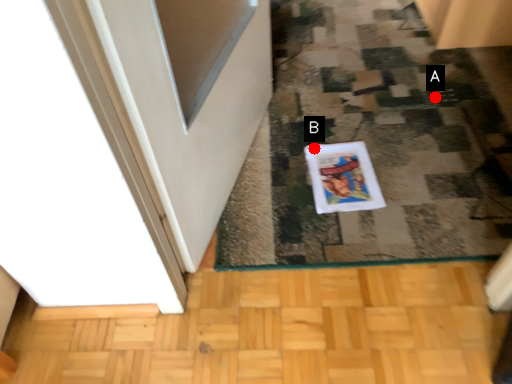
Question: Two points are circled on the image, labeled by A and B beside each circle. Which point is closer to the camera taking this photo?

Choices:
 (A) A is closer
 (B) B is closer

Answer: (B)